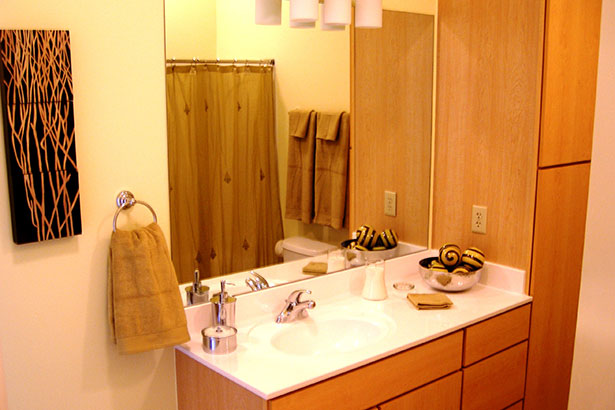
Find the location of `mirror`. mirror is located at coordinates (187, 17), (253, 90), (320, 144), (375, 198), (410, 235), (411, 27), (328, 158), (240, 225).